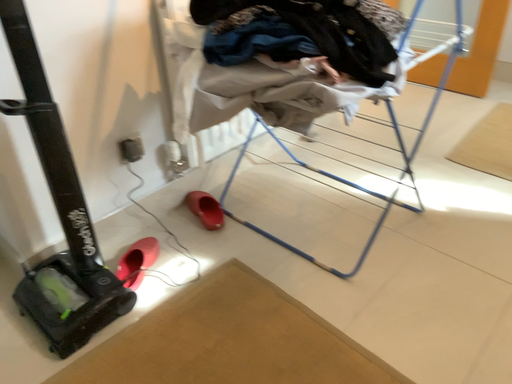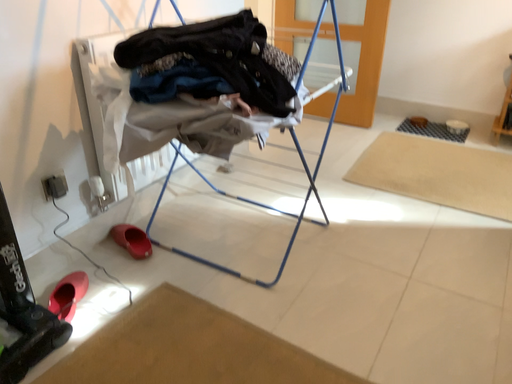
Question: Which way did the camera rotate in the video?

Choices:
 (A) rotated left
 (B) rotated right

Answer: (B)